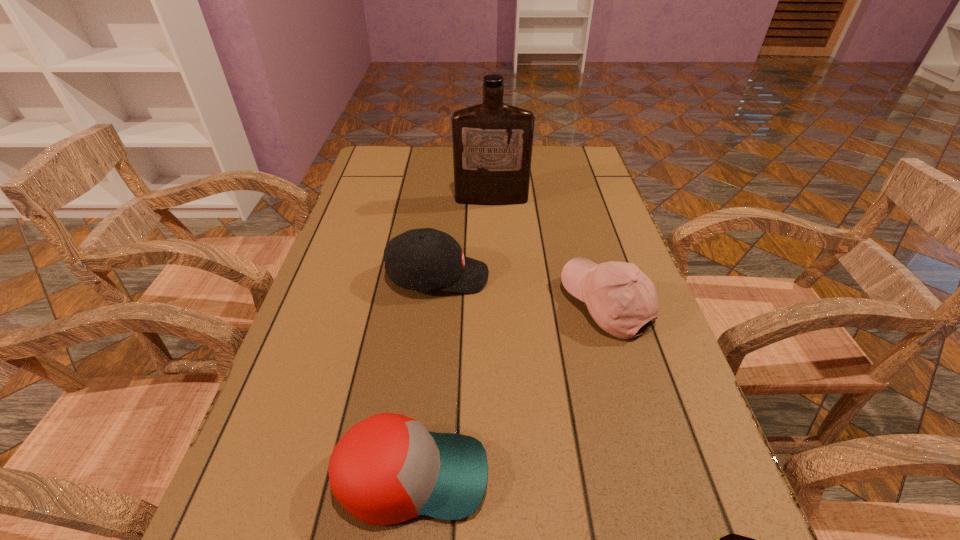
Locate an element on the screen. The width and height of the screenshot is (960, 540). the farthest object is located at coordinates (492, 142).

Where is `liquor`? This screenshot has height=540, width=960. liquor is located at coordinates click(x=492, y=142).

Where is `the rightmost baseball cap`? This screenshot has width=960, height=540. the rightmost baseball cap is located at coordinates (621, 299).

The image size is (960, 540). Find the location of `the fourth tallest object`. the fourth tallest object is located at coordinates (388, 468).

At what (x,y) coordinates should I click in order to perform the action: click on the shortest baseball cap. Please return your answer as a coordinate pair (x, y). The height and width of the screenshot is (540, 960). Looking at the image, I should click on (388, 468).

The image size is (960, 540). Find the location of `free spot located on the label side of the farthest object`. free spot located on the label side of the farthest object is located at coordinates (492, 231).

Identify the location of vacant region located on the front-facing side of the rightmost baseball cap. Image resolution: width=960 pixels, height=540 pixels. (498, 305).

I want to click on vacant space situated 0.140m on the front-facing side of the rightmost baseball cap, so click(498, 305).

Where is `vacant space situated 0.360m on the front-facing side of the rightmost baseball cap`? vacant space situated 0.360m on the front-facing side of the rightmost baseball cap is located at coordinates (396, 305).

I want to click on free space located at the brim of the shortest baseball cap, so click(x=670, y=475).